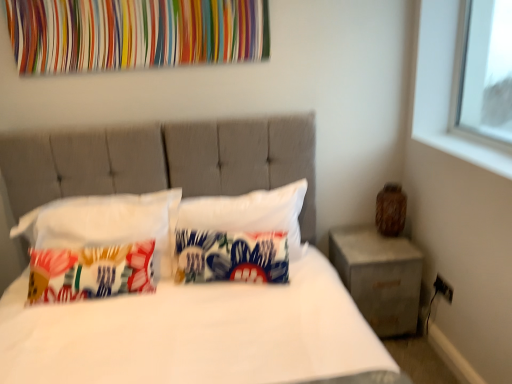
What do you see at coordinates (240, 236) in the screenshot? Image resolution: width=512 pixels, height=384 pixels. I see `white fabric pillow at center, the third pillow when ordered from left to right` at bounding box center [240, 236].

The width and height of the screenshot is (512, 384). I want to click on white fabric pillow at center, the third pillow when ordered from left to right, so click(x=240, y=236).

Describe the element at coordinates (231, 257) in the screenshot. The height and width of the screenshot is (384, 512). I see `printed fabric pillow at center, the 2th pillow positioned from the right` at that location.

What are the coordinates of `multicolored fabric at upper center` in the screenshot? It's located at (134, 33).

What are the coordinates of `white fabric pillow at center, the 1th pillow in the right-to-left sequence` in the screenshot? It's located at (240, 236).

What's the angular difference between white fabric pillow at center, the 1th pillow in the right-to-left sequence, and printed fabric pillow at center, marked as the 2th pillow in a left-to-right arrangement,'s facing directions?

The angular difference between white fabric pillow at center, the 1th pillow in the right-to-left sequence, and printed fabric pillow at center, marked as the 2th pillow in a left-to-right arrangement, is 9.86 degrees.

Is white fabric pillow at center, the 1th pillow in the right-to-left sequence, with printed fabric pillow at center, the 2th pillow positioned from the right?

Yes, white fabric pillow at center, the 1th pillow in the right-to-left sequence, is touching printed fabric pillow at center, the 2th pillow positioned from the right.

Between white fabric pillow at center, the 1th pillow in the right-to-left sequence, and printed fabric pillow at center, the 2th pillow positioned from the right, which one appears on the right side from the viewer's perspective?

white fabric pillow at center, the 1th pillow in the right-to-left sequence.

From the image's perspective, is white fabric pillow at center, the 1th pillow in the right-to-left sequence, under printed fabric pillow at center, the 2th pillow positioned from the right?

No, from the image's perspective, white fabric pillow at center, the 1th pillow in the right-to-left sequence, is not below printed fabric pillow at center, the 2th pillow positioned from the right.

Is white fabric pillow at center, the 1th pillow in the right-to-left sequence, closer to camera compared to white fabric bed at center?

That is False.

Is white fabric pillow at center, the 1th pillow in the right-to-left sequence, oriented towards white fabric bed at center?

Yes, white fabric pillow at center, the 1th pillow in the right-to-left sequence, faces towards white fabric bed at center.

From the image's perspective, is white fabric pillow at center, the 1th pillow in the right-to-left sequence, above or below white fabric bed at center?

white fabric pillow at center, the 1th pillow in the right-to-left sequence, is above white fabric bed at center.

From a real-world perspective, is white fabric pillow at center, the 1th pillow in the right-to-left sequence, physically located above or below white fabric bed at center?

In terms of real-world spatial position, white fabric pillow at center, the 1th pillow in the right-to-left sequence, is below white fabric bed at center.

Considering the sizes of objects concrete/rough concrete nightstand at right and white fabric bed at center in the image provided, who is bigger, concrete/rough concrete nightstand at right or white fabric bed at center?

white fabric bed at center is bigger.

Is concrete/rough concrete nightstand at right turned away from white fabric bed at center?

concrete/rough concrete nightstand at right does not have its back to white fabric bed at center.

Is concrete/rough concrete nightstand at right wider than white fabric bed at center?

No, concrete/rough concrete nightstand at right is not wider than white fabric bed at center.

This screenshot has height=384, width=512. Identify the location of nightstand beneath the printed fabric pillow at center, the 2th pillow positioned from the right (from a real-world perspective). (379, 276).

Is concrete/rough concrete nightstand at right placed right next to printed fabric pillow at center, marked as the 2th pillow in a left-to-right arrangement?

No, concrete/rough concrete nightstand at right is not with printed fabric pillow at center, marked as the 2th pillow in a left-to-right arrangement.

Is concrete/rough concrete nightstand at right bigger or smaller than printed fabric pillow at center, the 2th pillow positioned from the right?

Considering their sizes, concrete/rough concrete nightstand at right takes up more space than printed fabric pillow at center, the 2th pillow positioned from the right.

From a real-world perspective, does concrete/rough concrete nightstand at right stand above printed fabric pillow at center, the 2th pillow positioned from the right?

Actually, concrete/rough concrete nightstand at right is physically below printed fabric pillow at center, the 2th pillow positioned from the right, in the real world.

Find the location of a particular element. The image size is (512, 384). the 1st pillow to the right when counting from the printed fabric pillow at left, marked as the third pillow in a right-to-left arrangement is located at coordinates (231, 257).

Is printed fabric pillow at center, marked as the 2th pillow in a left-to-right arrangement, to the left of printed fabric pillow at left, marked as the 1th pillow in a left-to-right arrangement, from the viewer's perspective?

No, printed fabric pillow at center, marked as the 2th pillow in a left-to-right arrangement, is not to the left of printed fabric pillow at left, marked as the 1th pillow in a left-to-right arrangement.

From a real-world perspective, which object stands above the other?

printed fabric pillow at left, marked as the 1th pillow in a left-to-right arrangement, from a real-world perspective.

Is white fabric pillow at center, the 1th pillow in the right-to-left sequence, completely or partially outside of printed fabric pillow at left, marked as the 1th pillow in a left-to-right arrangement?

Yes, white fabric pillow at center, the 1th pillow in the right-to-left sequence, is not within printed fabric pillow at left, marked as the 1th pillow in a left-to-right arrangement.

This screenshot has height=384, width=512. Find the location of `pillow positioned vertically above the white fabric pillow at center, the third pillow when ordered from left to right (from a real-world perspective)`. pillow positioned vertically above the white fabric pillow at center, the third pillow when ordered from left to right (from a real-world perspective) is located at coordinates (99, 245).

Is point (250, 214) farther from viewer compared to point (118, 212)?

That is True.

Is white fabric pillow at center, the third pillow when ordered from left to right, with printed fabric pillow at left, marked as the third pillow in a right-to-left arrangement?

No, white fabric pillow at center, the third pillow when ordered from left to right, is not touching printed fabric pillow at left, marked as the third pillow in a right-to-left arrangement.

Is white fabric bed at center further to camera compared to concrete/rough concrete nightstand at right?

No.

Consider the image. Considering the sizes of objects white fabric bed at center and concrete/rough concrete nightstand at right in the image provided, who is thinner, white fabric bed at center or concrete/rough concrete nightstand at right?

Thinner between the two is concrete/rough concrete nightstand at right.

Would you say white fabric bed at center is a long distance from concrete/rough concrete nightstand at right?

Actually, white fabric bed at center and concrete/rough concrete nightstand at right are a little close together.

Is concrete/rough concrete nightstand at right surrounded by white fabric bed at center?

No, white fabric bed at center does not contain concrete/rough concrete nightstand at right.

Starting from the white fabric pillow at center, the third pillow when ordered from left to right, which pillow is the 1st one in front? Please provide its 2D coordinates.

[(231, 257)]

I want to click on bed below the white fabric pillow at center, the 1th pillow in the right-to-left sequence (from the image's perspective), so click(255, 330).

Which object lies further to the anchor point multicolored fabric at upper center, concrete/rough concrete nightstand at right or white fabric pillow at center, the 1th pillow in the right-to-left sequence?

concrete/rough concrete nightstand at right is further to multicolored fabric at upper center.

From the image, which object appears to be nearer to white fabric pillow at center, the 1th pillow in the right-to-left sequence, printed fabric pillow at left, marked as the third pillow in a right-to-left arrangement, or white fabric bed at center?

white fabric bed at center.

Which object lies further to the anchor point printed fabric pillow at left, marked as the 1th pillow in a left-to-right arrangement, concrete/rough concrete nightstand at right or multicolored fabric at upper center?

The object further to printed fabric pillow at left, marked as the 1th pillow in a left-to-right arrangement, is concrete/rough concrete nightstand at right.

Looking at the image, which one is located closer to printed fabric pillow at center, the 2th pillow positioned from the right, concrete/rough concrete nightstand at right or white fabric pillow at center, the 1th pillow in the right-to-left sequence?

white fabric pillow at center, the 1th pillow in the right-to-left sequence, lies closer to printed fabric pillow at center, the 2th pillow positioned from the right, than the other object.

Based on their spatial positions, is concrete/rough concrete nightstand at right or printed fabric pillow at left, marked as the 1th pillow in a left-to-right arrangement, further from printed fabric pillow at center, the 2th pillow positioned from the right?

concrete/rough concrete nightstand at right is further to printed fabric pillow at center, the 2th pillow positioned from the right.

From the image, which object appears to be farther from white fabric bed at center, white fabric pillow at center, the 1th pillow in the right-to-left sequence, or printed fabric pillow at center, the 2th pillow positioned from the right?

The object further to white fabric bed at center is white fabric pillow at center, the 1th pillow in the right-to-left sequence.

When comparing their distances from concrete/rough concrete nightstand at right, does printed fabric pillow at center, the 2th pillow positioned from the right, or white fabric pillow at center, the third pillow when ordered from left to right, seem closer?

white fabric pillow at center, the third pillow when ordered from left to right, lies closer to concrete/rough concrete nightstand at right than the other object.

Estimate the real-world distances between objects in this image. Which object is further from white fabric bed at center, printed fabric pillow at center, the 2th pillow positioned from the right, or printed fabric pillow at left, marked as the 1th pillow in a left-to-right arrangement?

printed fabric pillow at left, marked as the 1th pillow in a left-to-right arrangement, lies further to white fabric bed at center than the other object.

Find the location of `pillow between multicolored fabric at upper center and printed fabric pillow at left, marked as the 1th pillow in a left-to-right arrangement, in the up-down direction`. pillow between multicolored fabric at upper center and printed fabric pillow at left, marked as the 1th pillow in a left-to-right arrangement, in the up-down direction is located at coordinates point(240,236).

At what (x,y) coordinates should I click in order to perform the action: click on tapestry between white fabric bed at center and concrete/rough concrete nightstand at right along the z-axis. Please return your answer as a coordinate pair (x, y). The height and width of the screenshot is (384, 512). Looking at the image, I should click on (134, 33).

Locate an element on the screen. This screenshot has height=384, width=512. pillow located between printed fabric pillow at left, marked as the third pillow in a right-to-left arrangement, and white fabric pillow at center, the 1th pillow in the right-to-left sequence, in the left-right direction is located at coordinates (231, 257).

I want to click on tapestry between printed fabric pillow at left, marked as the 1th pillow in a left-to-right arrangement, and concrete/rough concrete nightstand at right, in the horizontal direction, so click(x=134, y=33).